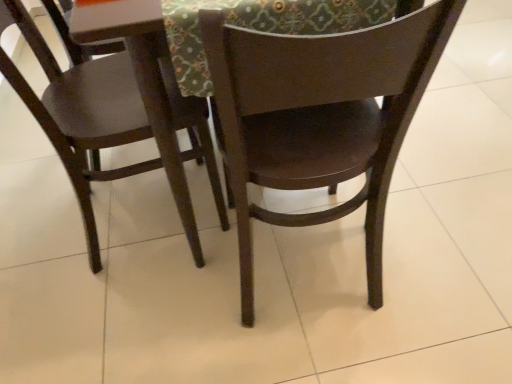
Question: Is textured fabric at upper center not near matte brown table at center?

Choices:
 (A) yes
 (B) no

Answer: (B)

Question: Does textured fabric at upper center appear on the right side of matte brown table at center?

Choices:
 (A) no
 (B) yes

Answer: (B)

Question: Is textured fabric at upper center to the left of matte brown table at center from the viewer's perspective?

Choices:
 (A) no
 (B) yes

Answer: (A)

Question: Is matte brown table at center at the back of textured fabric at upper center?

Choices:
 (A) yes
 (B) no

Answer: (A)

Question: From a real-world perspective, is textured fabric at upper center positioned over matte brown table at center based on gravity?

Choices:
 (A) yes
 (B) no

Answer: (A)

Question: Considering their positions, is textured fabric at upper center located in front of or behind matte wood chair at left, which ranks as the 2th chair in right-to-left order?

Choices:
 (A) behind
 (B) front

Answer: (B)

Question: Is textured fabric at upper center bigger or smaller than matte wood chair at left, which ranks as the 2th chair in right-to-left order?

Choices:
 (A) small
 (B) big

Answer: (A)

Question: Is point (289, 21) positioned closer to the camera than point (13, 71)?

Choices:
 (A) closer
 (B) farther

Answer: (A)

Question: From their relative heights in the image, would you say textured fabric at upper center is taller or shorter than matte wood chair at left, which ranks as the 2th chair in right-to-left order?

Choices:
 (A) short
 (B) tall

Answer: (A)

Question: Choose the correct answer: Is dark wood chair at center, arranged as the second chair when viewed from the left, inside matte brown table at center or outside it?

Choices:
 (A) inside
 (B) outside

Answer: (A)

Question: From a real-world perspective, is dark wood chair at center, the first chair viewed from the right, positioned above or below matte brown table at center?

Choices:
 (A) above
 (B) below

Answer: (A)

Question: Relative to matte brown table at center, is dark wood chair at center, the first chair viewed from the right, in front or behind?

Choices:
 (A) front
 (B) behind

Answer: (A)

Question: Is point (312, 167) closer or farther from the camera than point (174, 157)?

Choices:
 (A) closer
 (B) farther

Answer: (A)

Question: From the image's perspective, is matte brown table at center positioned above or below dark wood chair at center, the first chair viewed from the right?

Choices:
 (A) above
 (B) below

Answer: (A)

Question: Is matte brown table at center wider or thinner than dark wood chair at center, arranged as the second chair when viewed from the left?

Choices:
 (A) wide
 (B) thin

Answer: (A)